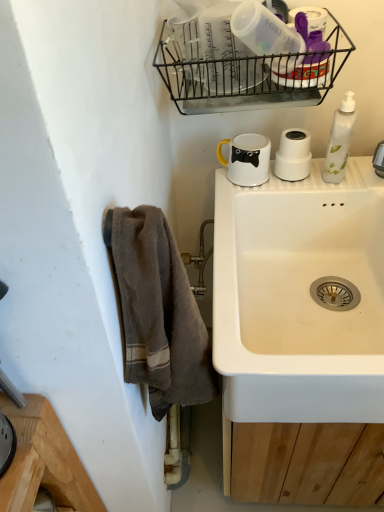
Find the location of a particular element. vacant area that lies to the right of white glossy mug at upper right is located at coordinates (321, 180).